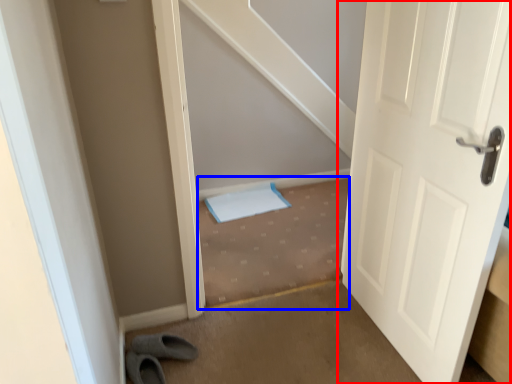
Question: Which of the following is the farthest to the observer, door (highlighted by a red box) or stairwell (highlighted by a blue box)?

Choices:
 (A) door
 (B) stairwell

Answer: (B)